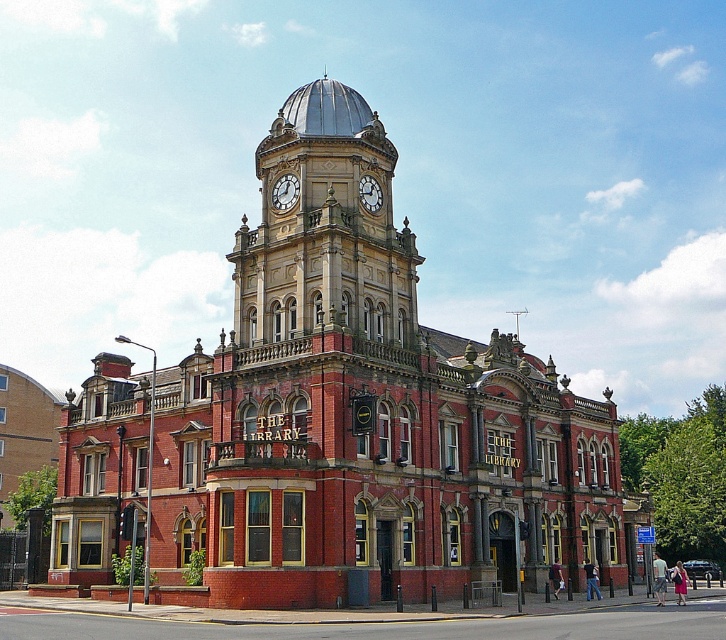
You are a maintenance worker needing to inspect both the gold metallic clock at upper center and the white painted metal clock at upper center on the clock tower. Given that your ladder can extend up to 15 feet, can you safely reach both clocks without moving the ladder?

The gold metallic clock at upper center and white painted metal clock at upper center are 18.28 feet apart from each other. Since the ladder can only extend up to 15 feet, you cannot safely reach both clocks without moving the ladder because the distance between them exceeds the ladder length.

You are an architect inspecting the building from the street corner. You notice both the polished brass clock tower at upper center and the white painted metal clock at upper center. Which of these two objects is taller?

The polished brass clock tower at upper center is much taller than the white painted metal clock at upper center.

You are standing at the corner of the street looking at the grand building with its clock tower. There is a point marked at coordinates point [325,228]. Based on the scene description, can you identify what structure this point is located on?

The point [325,228] is located on the polished brass clock tower at upper center.